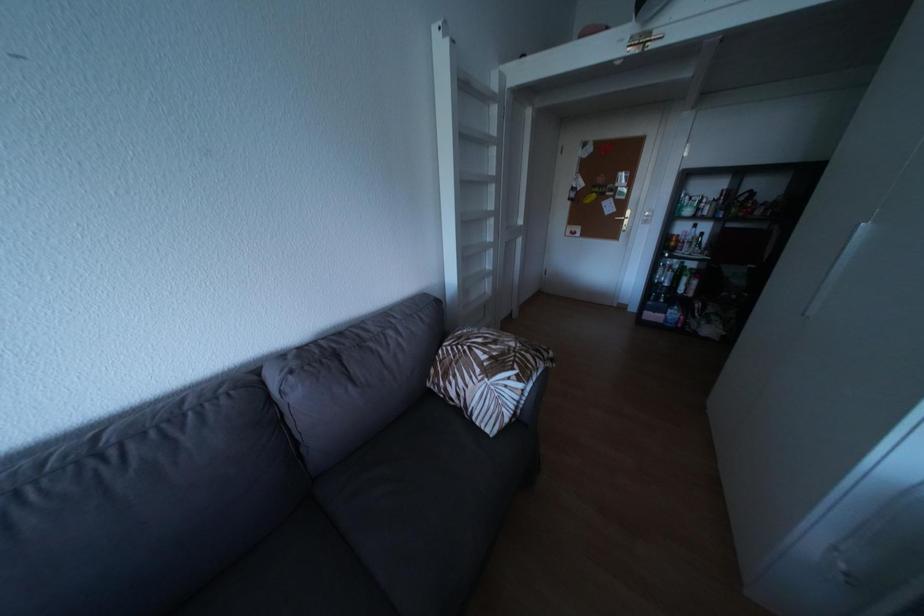
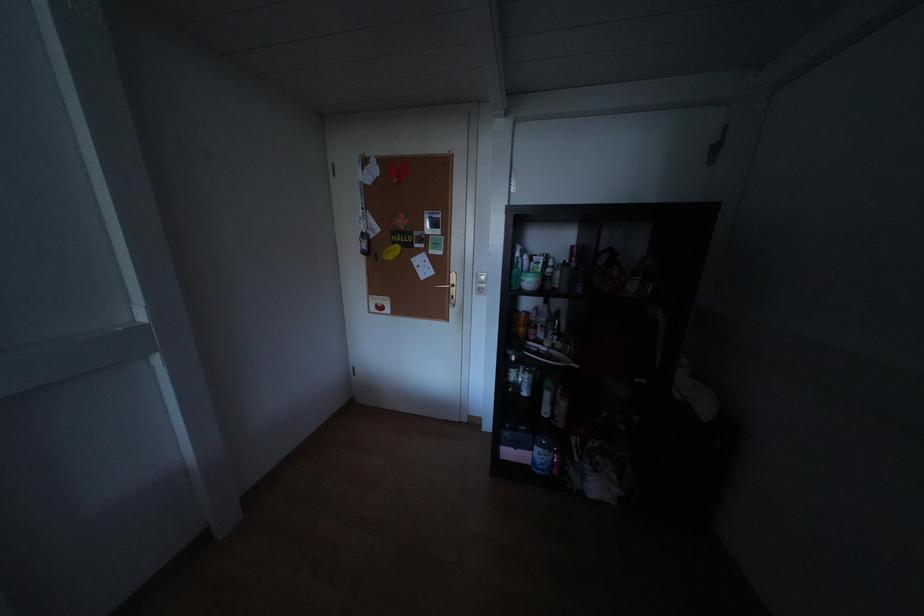
Which direction would the cameraman need to move to produce the second image?

The movement direction of the cameraman is right, forward.